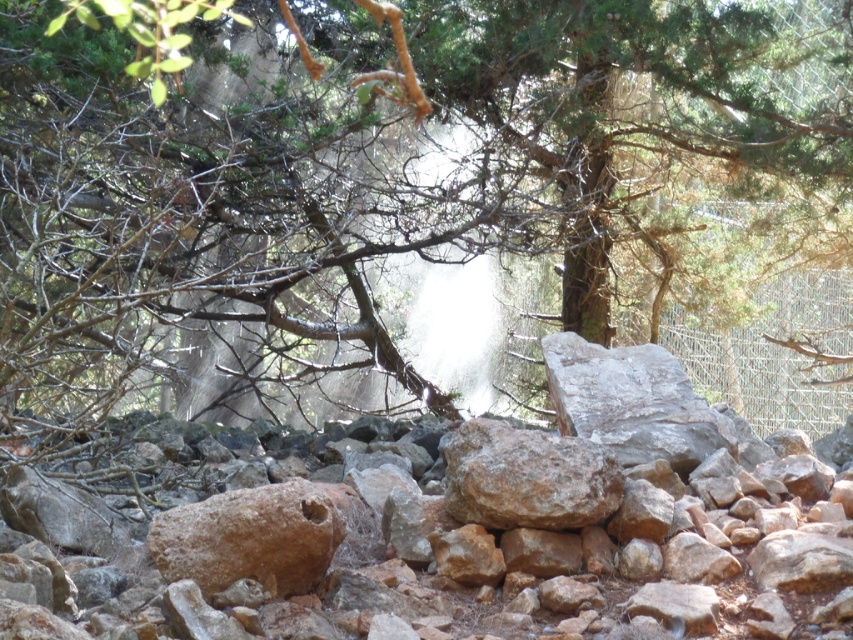
What do you see at coordinates (503, 524) in the screenshot? The width and height of the screenshot is (853, 640). I see `rusty stone at center` at bounding box center [503, 524].

Between point (325, 598) and point (564, 436), which one is positioned behind?

Point (564, 436)

Find the location of `rusty stone at center`. rusty stone at center is located at coordinates (503, 524).

Can you confirm if green textured tree at center is smaller than brown rough rock at center?

Actually, green textured tree at center might be larger than brown rough rock at center.

Does point (167, 182) lie behind point (480, 500)?

Yes, point (167, 182) is behind point (480, 500).

Is point (323, 308) closer to viewer compared to point (621, 472)?

No, it is behind (621, 472).

The height and width of the screenshot is (640, 853). What are the coordinates of `green textured tree at center` in the screenshot? It's located at (390, 177).

Which is more to the left, green textured tree at center or rusty stone at center?

Positioned to the left is green textured tree at center.

Does point (35, 64) come farther from viewer compared to point (614, 400)?

That is True.

Identify the location of green textured tree at center. The image size is (853, 640). coord(390,177).